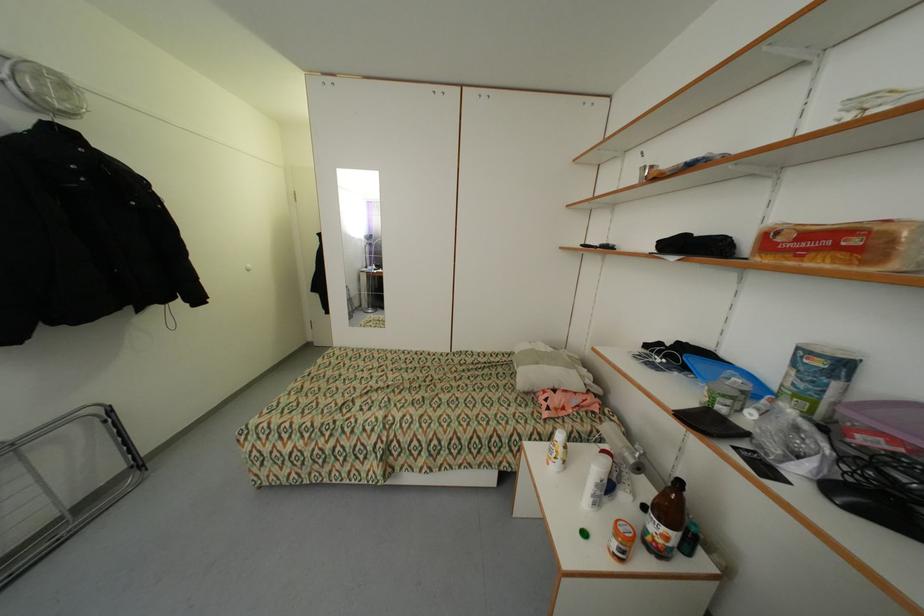
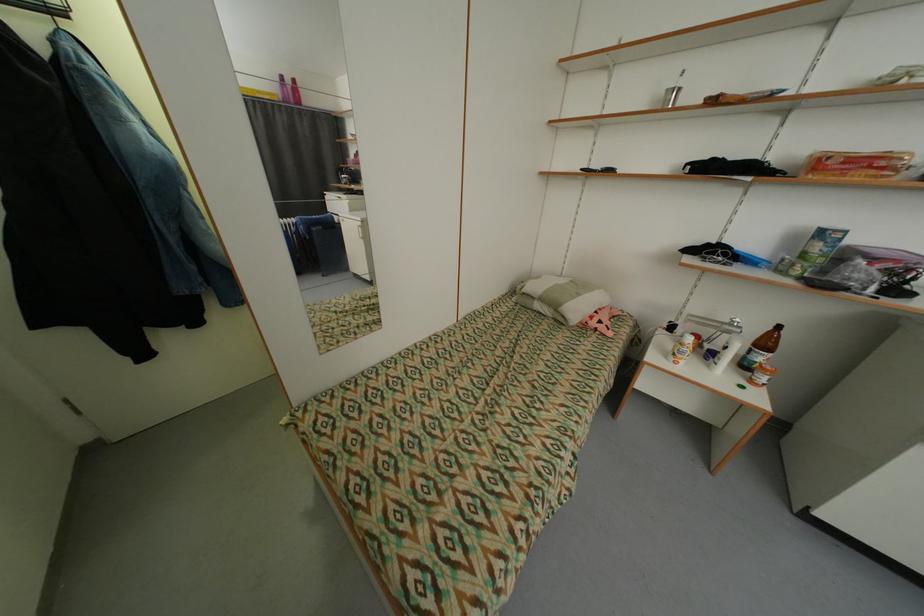
Find the pixel in the second image that matches point (542, 363) in the first image.

(585, 296)